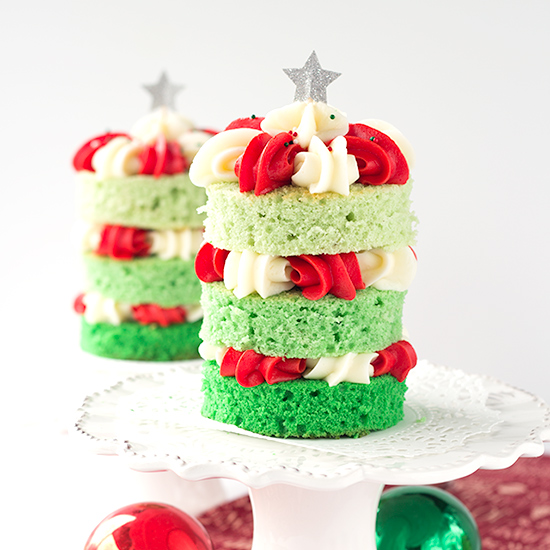
Identify the location of cake stand. Image resolution: width=550 pixels, height=550 pixels. (343, 481).